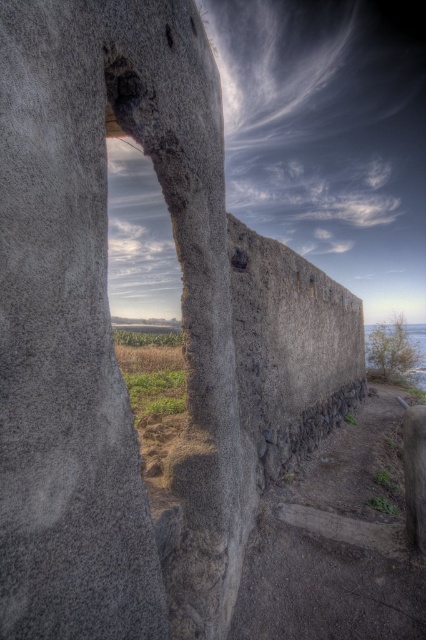
Looking at the weathered stone wall with its historical texture, you notice two features at the center area. Which one is positioned to the right when comparing the gray rough concrete crack at center and the smooth concrete hole at center?

The gray rough concrete crack at center is positioned to the right of the smooth concrete hole at center.

You are an architect examining the stone wall and need to determine the placement of a new support beam. The beam must be placed between the gray rough concrete crack at center and the smooth stone hole at upper center. Which object should the beam be placed closer to in order to stabilize the wall?

The beam should be placed closer to the gray rough concrete crack at center because it is positioned under the smooth stone hole at upper center, making it the lower point of support.

You are a delivery drone carrying a package that needs to land on the smooth concrete hole at center. The drone requires a minimum of 8 feet of clearance to safely descend. Based on the scene, can the drone safely land?

The smooth concrete hole at center is 7.71 feet apart from the other object. Since the required clearance is 8 feet, the drone cannot safely land as the distance is insufficient.